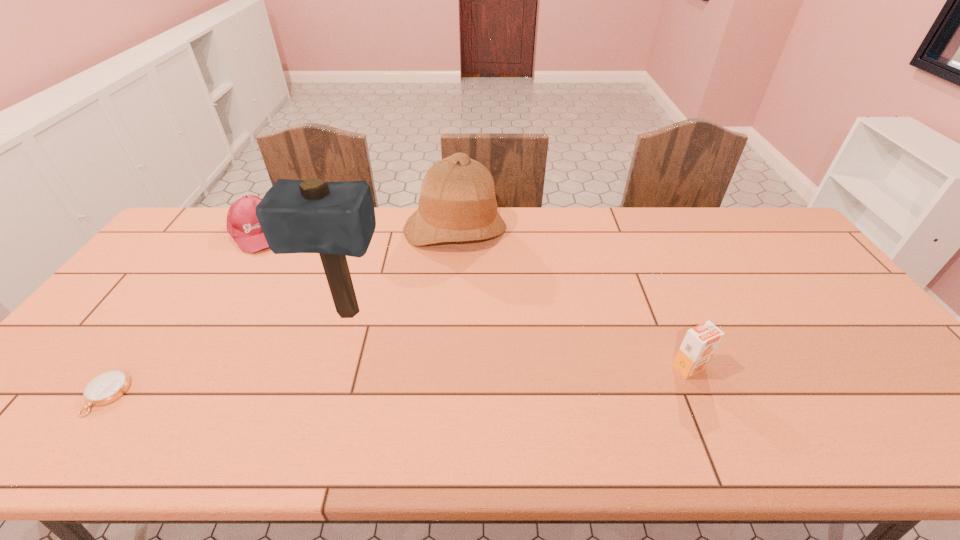
This screenshot has width=960, height=540. I want to click on vacant space on the desktop that is between the compass and the orange juice and is positioned on the front-facing side of the hat, so click(x=463, y=379).

At what (x,y) coordinates should I click in order to perform the action: click on free space on the desktop that is between the shortest object and the third shortest object and is positioned on the striking surface of the third nearest object. Please return your answer as a coordinate pair (x, y). Looking at the image, I should click on (320, 385).

At what (x,y) coordinates should I click in order to perform the action: click on vacant space on the desktop that is between the compass and the third shortest object and is positioned at the front of the baseball cap with the brim. Please return your answer as a coordinate pair (x, y). Looking at the image, I should click on (325, 384).